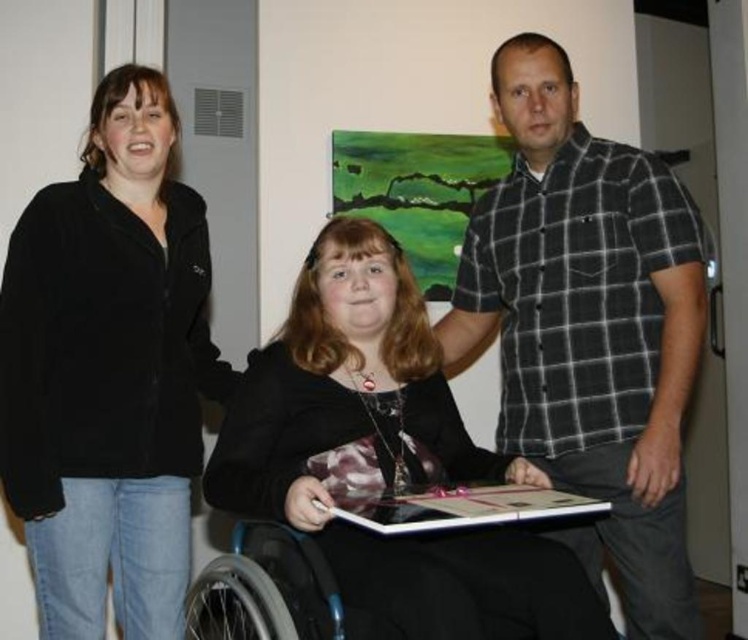
Is black fleece jacket at left to the right of black matte wheelchair at center from the viewer's perspective?

No, black fleece jacket at left is not to the right of black matte wheelchair at center.

This screenshot has width=748, height=640. Identify the location of black fleece jacket at left. (108, 371).

Does point (16, 253) lie in front of point (557, 596)?

No.

Identify the location of black fleece jacket at left. (108, 371).

Is black fleece jacket at left below plaid shirt at center?

Yes, black fleece jacket at left is below plaid shirt at center.

Does point (165, 260) lie behind point (666, 310)?

Yes.

Which is in front, point (46, 600) or point (548, 125)?

Point (46, 600) is more forward.

Find the location of a particular element. The image size is (748, 640). black fleece jacket at left is located at coordinates (108, 371).

Is plaid shirt at center wider than black matte wheelchair at center?

In fact, plaid shirt at center might be narrower than black matte wheelchair at center.

Does plaid shirt at center come in front of black matte wheelchair at center?

No, plaid shirt at center is further to the viewer.

At what (x,y) coordinates should I click in order to perform the action: click on plaid shirt at center. Please return your answer as a coordinate pair (x, y). The width and height of the screenshot is (748, 640). Looking at the image, I should click on (589, 326).